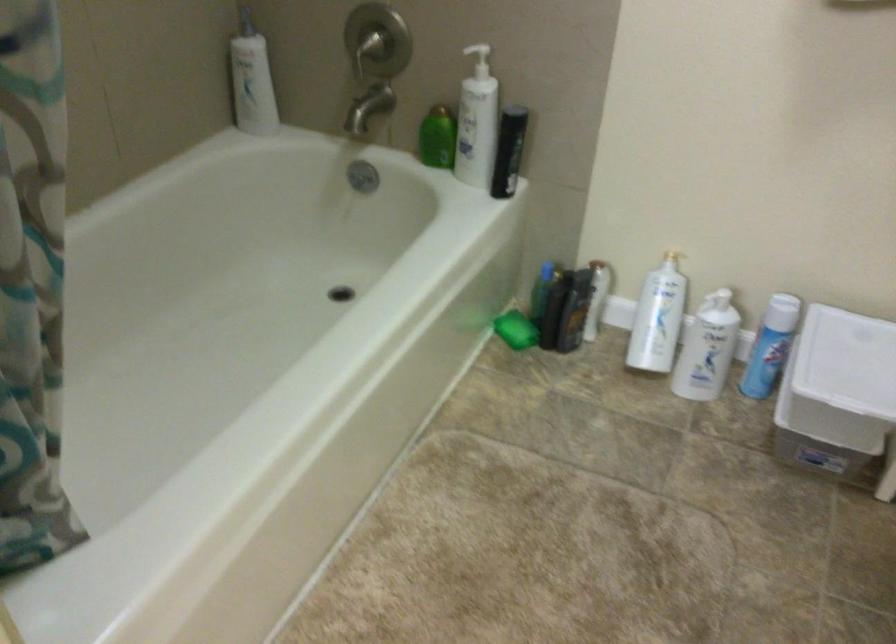
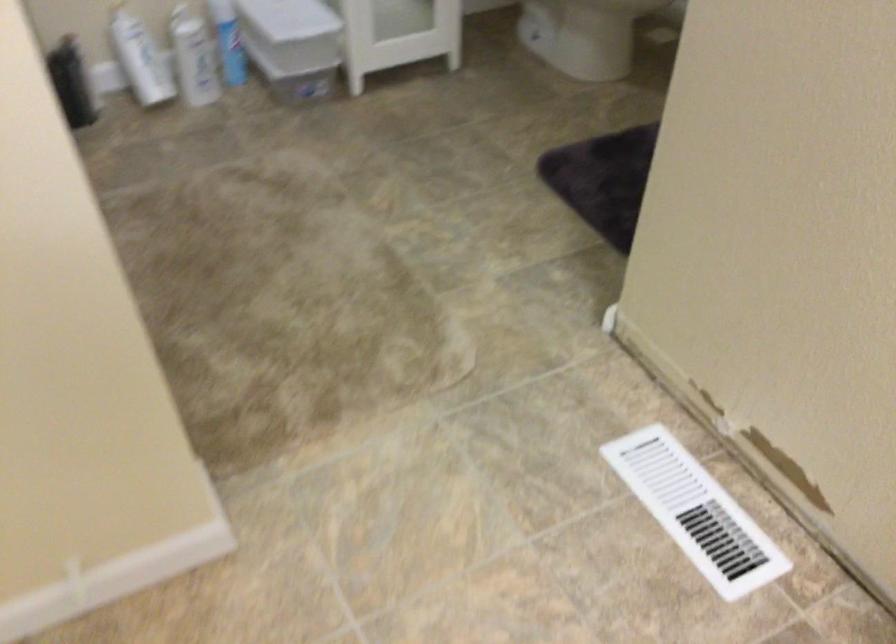
The point at (549,308) is marked in the first image. Where is the corresponding point in the second image?

(72, 82)